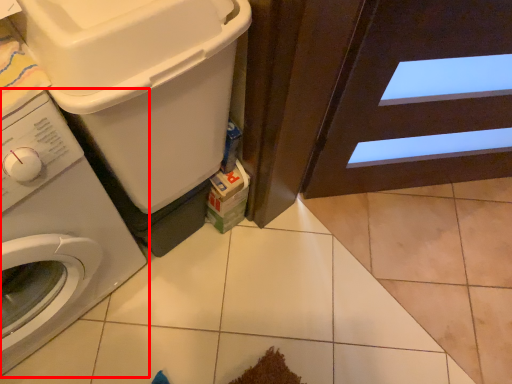
Question: Considering the relative positions of washing machine (annotated by the red box) and washing machine in the image provided, where is washing machine (annotated by the red box) located with respect to the staircase?

Choices:
 (A) left
 (B) right

Answer: (A)